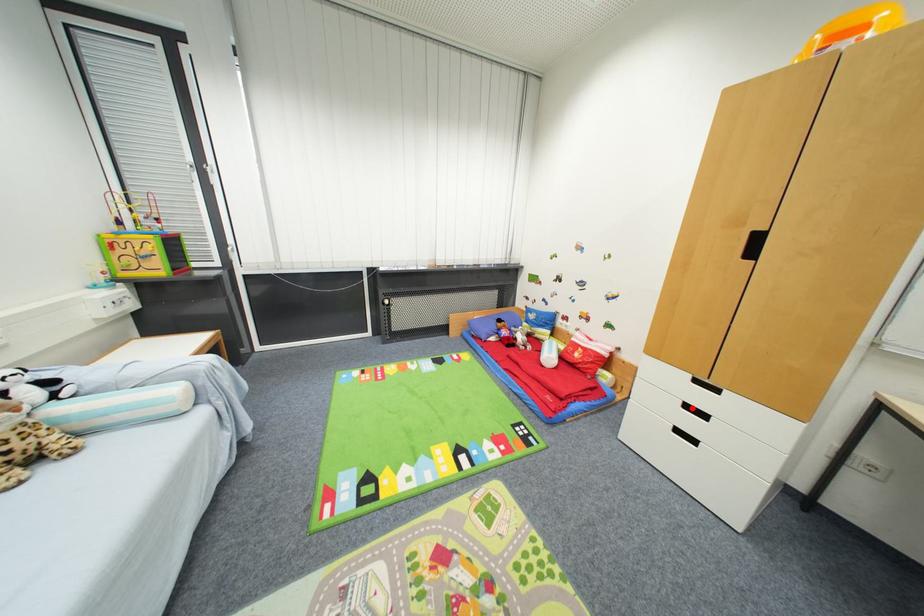
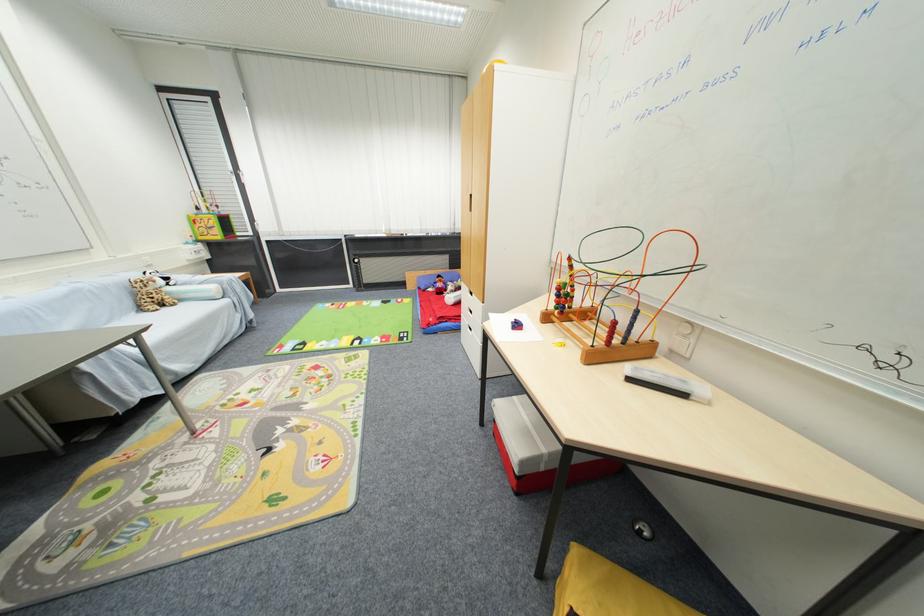
Locate, in the second image, the point that corresponds to the highlighted location in the first image.

(473, 310)